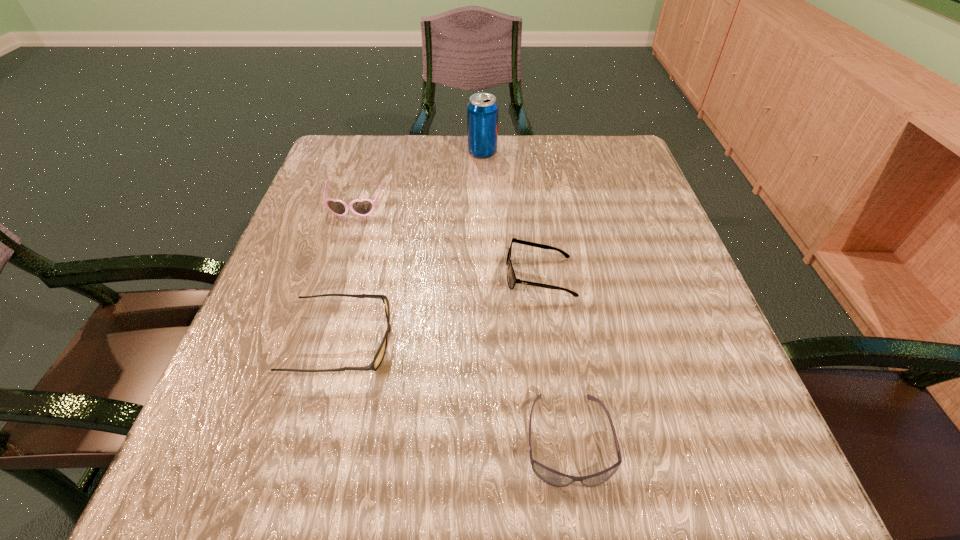
Find the location of a particular element. This screenshot has height=540, width=960. the tallest object is located at coordinates (482, 110).

Locate an element on the screen. the farthest object is located at coordinates (482, 110).

The height and width of the screenshot is (540, 960). I want to click on the second farthest object, so click(364, 207).

Locate an element on the screen. Image resolution: width=960 pixels, height=540 pixels. the second farthest sunglasses is located at coordinates (511, 277).

Find the location of a particular element. The image size is (960, 540). the second nearest object is located at coordinates (x=380, y=354).

The width and height of the screenshot is (960, 540). Find the location of `the nearest sunglasses`. the nearest sunglasses is located at coordinates (552, 477).

Identify the location of vacant region located on the left of the pop soda. (370, 153).

Locate an element on the screen. The image size is (960, 540). free space located on the front-facing side of the farthest sunglasses is located at coordinates coord(325,301).

In order to click on free space located 0.100m on the front-facing side of the third nearest sunglasses in this screenshot , I will do `click(450, 275)`.

This screenshot has height=540, width=960. What are the coordinates of `vacant region located on the front-facing side of the third nearest sunglasses` in the screenshot? It's located at (433, 275).